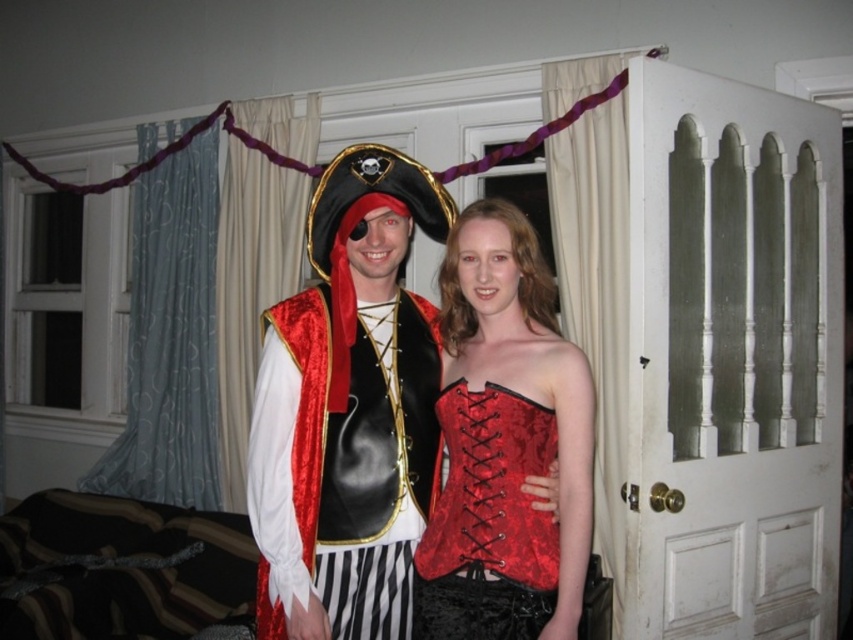
Question: Does velvet pirate costume at center appear over red velvet corset at center?

Choices:
 (A) yes
 (B) no

Answer: (A)

Question: Which is nearer to the velvet red corset at center?

Choices:
 (A) red velvet corset at center
 (B) velvet/red vest at center

Answer: (A)

Question: Which object appears farthest from the camera in this image?

Choices:
 (A) velvet pirate costume at center
 (B) red velvet corset at center

Answer: (A)

Question: Which object is the closest to the velvet pirate costume at center?

Choices:
 (A) velvet/red vest at center
 (B) red velvet corset at center
 (C) velvet red corset at center

Answer: (A)

Question: From the image, what is the correct spatial relationship of velvet pirate costume at center in relation to red velvet corset at center?

Choices:
 (A) right
 (B) left

Answer: (B)

Question: Is velvet pirate costume at center closer to camera compared to velvet red corset at center?

Choices:
 (A) no
 (B) yes

Answer: (A)